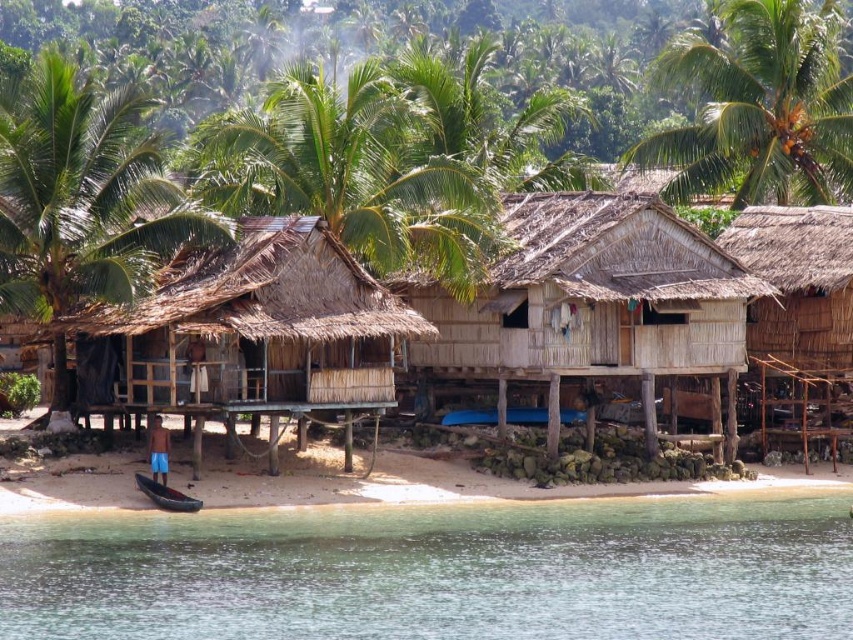
Question: Which object is positioned closest to the wooden canoe at lower left?

Choices:
 (A) green leafy palm tree at upper right
 (B) blue plastic boat at center
 (C) green leafy palm tree at upper center

Answer: (C)

Question: Does clear water at lower left have a larger size compared to green leafy palm tree at upper left?

Choices:
 (A) no
 (B) yes

Answer: (A)

Question: Considering the real-world distances, which object is farthest from the green leafy palm tree at upper left?

Choices:
 (A) green leafy palm tree at upper right
 (B) blue plastic boat at center
 (C) wooden canoe at lower left

Answer: (A)

Question: Estimate the real-world distances between objects in this image. Which object is closer to the green leafy palm tree at upper right?

Choices:
 (A) green leafy palm tree at upper center
 (B) wooden canoe at lower left
 (C) blue plastic boat at center
 (D) green leafy palm tree at upper left

Answer: (A)

Question: Is clear water at lower left behind green leafy palm tree at upper right?

Choices:
 (A) yes
 (B) no

Answer: (B)

Question: Is thatched bamboo hut at center closer to the viewer compared to green leafy palm tree at upper left?

Choices:
 (A) no
 (B) yes

Answer: (A)